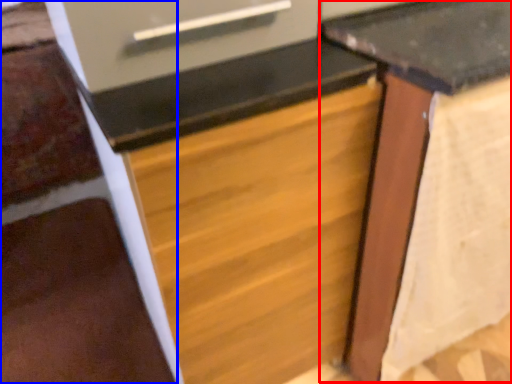
Question: Which object appears closest to the camera in this image, table (highlighted by a red box) or stairwell (highlighted by a blue box)?

Choices:
 (A) table
 (B) stairwell

Answer: (A)